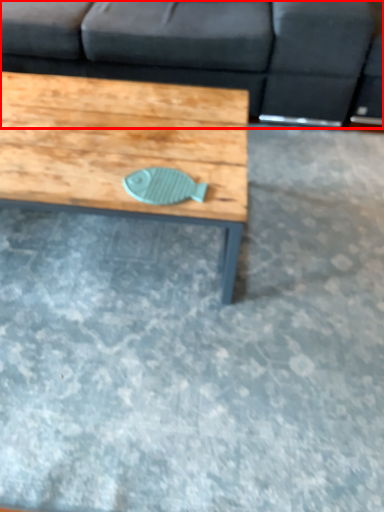
Question: Where is studio couch (annotated by the red box) located in relation to coffee table in the image?

Choices:
 (A) right
 (B) left

Answer: (A)